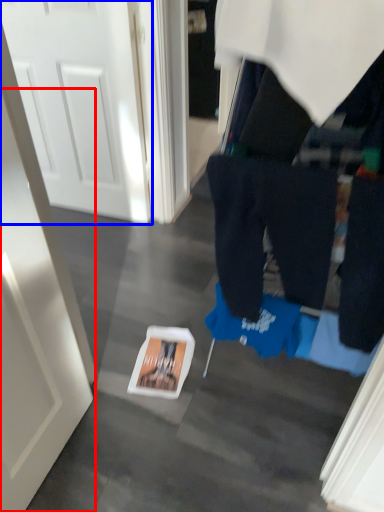
Question: Which object is closer to the camera taking this photo, door (highlighted by a red box) or door (highlighted by a blue box)?

Choices:
 (A) door
 (B) door

Answer: (A)